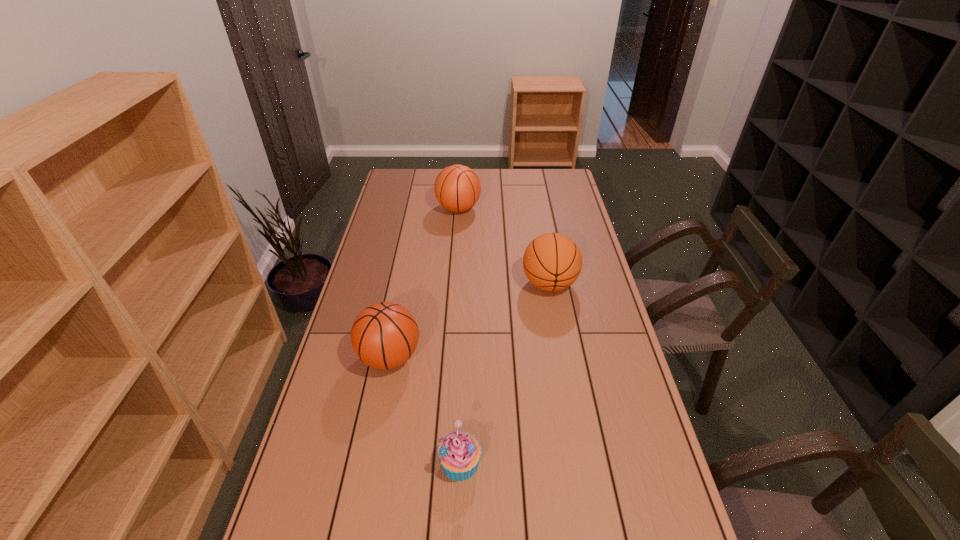
The image size is (960, 540). Identify the location of the farthest object. (457, 188).

What are the coordinates of `the rightmost basketball` in the screenshot? It's located at (552, 262).

Where is `the third nearest object`? The height and width of the screenshot is (540, 960). the third nearest object is located at coordinates (552, 262).

Identify the location of the nearest basketball. (384, 335).

Where is `muffin`? muffin is located at coordinates (459, 453).

Find the location of a particular element. the shortest object is located at coordinates (459, 453).

This screenshot has height=540, width=960. In order to click on free location located on the back of the farthest basketball in this screenshot , I will do `click(461, 169)`.

Where is `vacant area situated on the front of the rightmost object`? vacant area situated on the front of the rightmost object is located at coordinates (560, 342).

Locate an element on the screen. This screenshot has width=960, height=540. vacant space located 0.230m on the front of the nearest basketball is located at coordinates (370, 459).

At what (x,y) coordinates should I click in order to perform the action: click on vacant position located on the right of the muffin. Please return your answer as a coordinate pair (x, y). The width and height of the screenshot is (960, 540). Looking at the image, I should click on (631, 463).